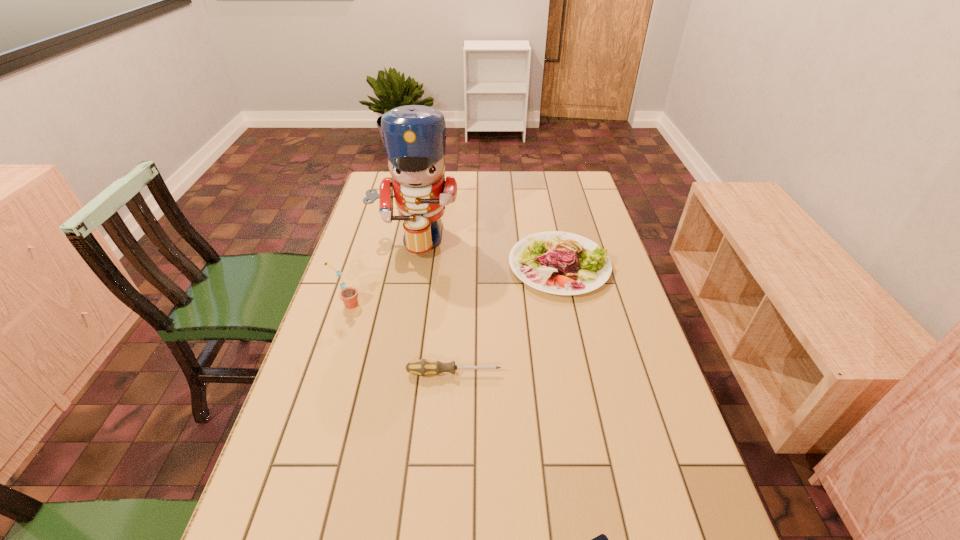
Find the location of a particular element. nutcracker is located at coordinates (414, 136).

Locate an element on the screen. The image size is (960, 540). sunflower is located at coordinates click(348, 295).

Identify the location of salad plate. (556, 262).

Where is `screwdriver`? Image resolution: width=960 pixels, height=540 pixels. screwdriver is located at coordinates (423, 367).

Find the location of a particular element. Image resolution: width=960 pixels, height=540 pixels. the fourth tallest object is located at coordinates (423, 367).

Where is `vacant space situated 0.110m on the front-facing side of the nutcracker`? The width and height of the screenshot is (960, 540). vacant space situated 0.110m on the front-facing side of the nutcracker is located at coordinates (405, 286).

Identify the location of free space located 0.260m on the flower of the sunflower. (450, 305).

At what (x,y) coordinates should I click in order to perform the action: click on vacant space located on the front of the salad plate. Please return your answer as a coordinate pair (x, y). Image resolution: width=960 pixels, height=540 pixels. Looking at the image, I should click on 571,320.

I want to click on vacant space located 0.370m at the tip of the fourth farthest object, so click(x=651, y=373).

Image resolution: width=960 pixels, height=540 pixels. What are the coordinates of `nutcracker located in the left edge section of the desktop` in the screenshot? It's located at (414, 136).